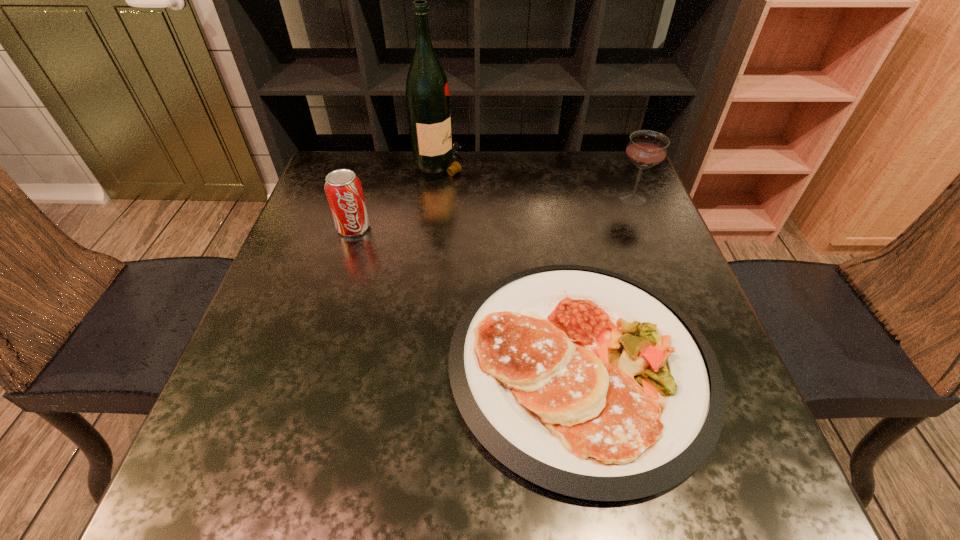
Locate an element on the screen. vacant position at the near edge of the desktop is located at coordinates (441, 495).

In the image, there is a desktop. Identify the location of blank space at the left edge. This screenshot has height=540, width=960. (349, 240).

The width and height of the screenshot is (960, 540). I want to click on vacant position at the right edge of the desktop, so click(x=650, y=258).

Find the location of a particular element. The image size is (960, 540). vacant area at the far left corner is located at coordinates (349, 159).

The image size is (960, 540). In the image, there is a desktop. What are the coordinates of `vacant space at the near left corner` in the screenshot? It's located at click(x=261, y=458).

Locate an element on the screen. free location at the far right corner is located at coordinates (593, 179).

The width and height of the screenshot is (960, 540). Identify the location of vacant area that lies between the wine bottle and the soda can. [x=397, y=195].

You are a GUI agent. You are given a task and a screenshot of the screen. Output one action in this format:
    pyautogui.click(x=<x>, y=<y>)
    Task: Click on the unoccupied area between the shortest object and the second nearest object
    
    Given the screenshot: What is the action you would take?
    pyautogui.click(x=468, y=296)

Image resolution: width=960 pixels, height=540 pixels. I want to click on free point between the leftmost object and the shortest object, so click(468, 296).

This screenshot has height=540, width=960. What are the coordinates of `unoccupied position between the second shortest object and the wine bottle` in the screenshot? It's located at (397, 195).